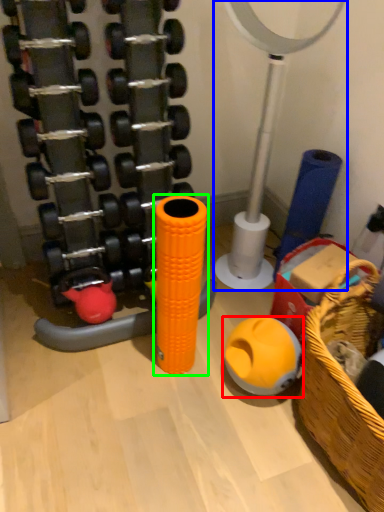
Question: Estimate the real-world distances between objects in this image. Which object is farther from toy (highlighted by a red box), basketball hoop (highlighted by a blue box) or toy (highlighted by a green box)?

Choices:
 (A) basketball hoop
 (B) toy

Answer: (A)